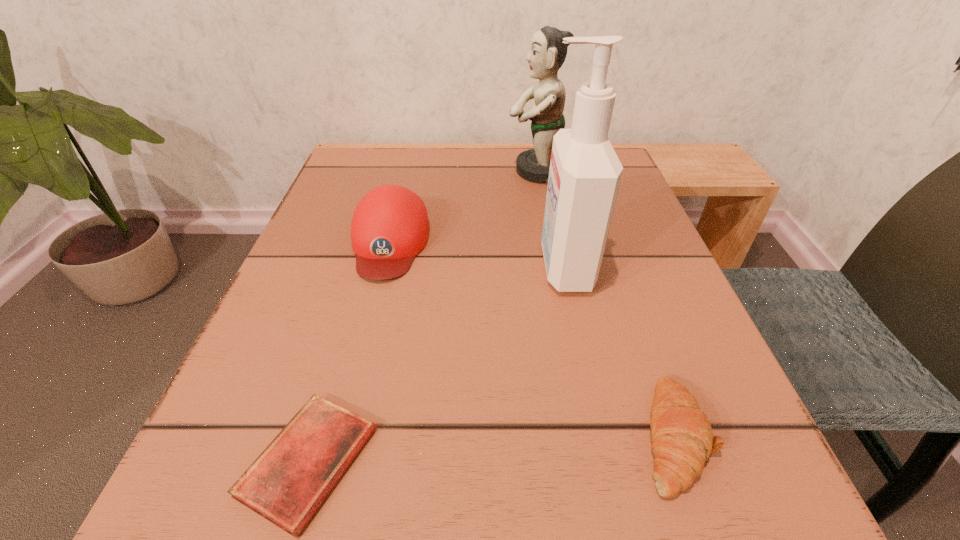
Identify the location of free space at the far left corner. (340, 195).

I want to click on free point at the near left corner, so click(159, 525).

Locate an element on the screen. free space at the near right corner of the desktop is located at coordinates (791, 509).

What are the coordinates of `empty space between the baseball cap and the crescent roll` in the screenshot? It's located at (532, 339).

In order to click on free space between the baseball cap and the diary in this screenshot , I will do `click(349, 352)`.

The image size is (960, 540). I want to click on vacant point located between the second shortest object and the tallest object, so point(619,351).

This screenshot has width=960, height=540. Find the location of `vacant region between the baseball cap and the tallest object`. vacant region between the baseball cap and the tallest object is located at coordinates (477, 254).

The height and width of the screenshot is (540, 960). In order to click on vacant region between the second tallest object and the third shortest object in this screenshot , I will do pos(465,206).

Where is `unoccupied area between the crescent roll and the shortest object`? Image resolution: width=960 pixels, height=540 pixels. unoccupied area between the crescent roll and the shortest object is located at coordinates (492, 448).

Identify the location of free space between the diary and the cleansing agent. This screenshot has width=960, height=540. (437, 364).